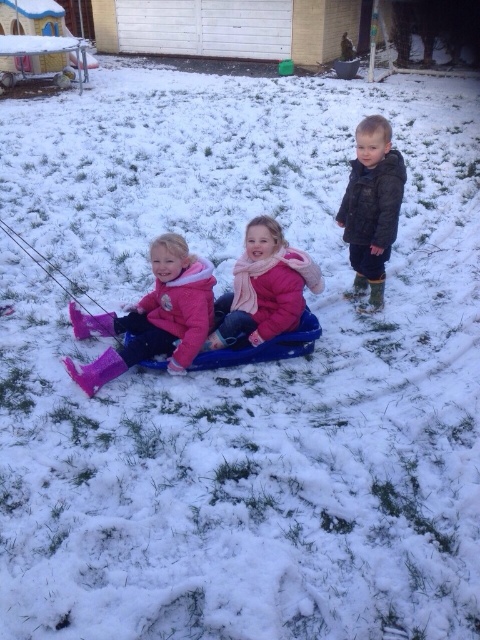
Question: Which point is farther to the camera?

Choices:
 (A) dark green jacket at upper right
 (B) matte pink snowsuit at left

Answer: (A)

Question: Which of these objects is positioned closest to the matte pink snowsuit at left?

Choices:
 (A) dark green jacket at upper right
 (B) pink fleece jacket at center

Answer: (B)

Question: Does matte pink snowsuit at left have a larger size compared to dark green jacket at upper right?

Choices:
 (A) yes
 (B) no

Answer: (A)

Question: Can you confirm if matte pink snowsuit at left is positioned to the right of dark green jacket at upper right?

Choices:
 (A) yes
 (B) no

Answer: (B)

Question: Which point appears farthest from the camera in this image?

Choices:
 (A) [299, 285]
 (B) [370, 257]
 (C) [134, 307]

Answer: (B)

Question: Can you confirm if matte pink snowsuit at left is smaller than dark green jacket at upper right?

Choices:
 (A) yes
 (B) no

Answer: (B)